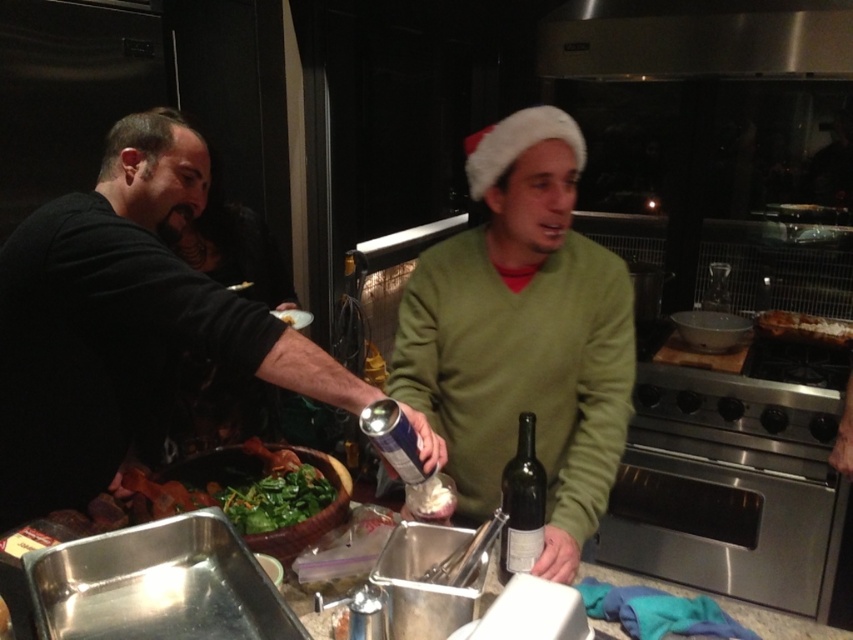
Consider the image. Is black matte shirt at left smaller than stainless steel exhaust hood at upper center?

No, black matte shirt at left is not smaller than stainless steel exhaust hood at upper center.

From the picture: Does black matte shirt at left have a lesser height compared to stainless steel exhaust hood at upper center?

No.

Is point (344, 380) closer to camera compared to point (787, 19)?

That is True.

You are a GUI agent. You are given a task and a screenshot of the screen. Output one action in this format:
    pyautogui.click(x=<x>, y=<y>)
    Task: Click on the black matte shirt at left
    Image resolution: width=853 pixels, height=640 pixels.
    Given the screenshot: What is the action you would take?
    pyautogui.click(x=123, y=323)

Is green matte sweater at center thinner than green leafy vegetables at center?

No.

Does point (506, 147) come farther from viewer compared to point (244, 500)?

Yes, point (506, 147) is behind point (244, 500).

This screenshot has width=853, height=640. What are the coordinates of `green matte sweater at center` in the screenshot? It's located at (521, 333).

Based on the photo, between black matte shirt at left and stainless steel oven at lower right, which one has more height?

black matte shirt at left is taller.

Describe the element at coordinates (123, 323) in the screenshot. I see `black matte shirt at left` at that location.

What do you see at coordinates (123, 323) in the screenshot?
I see `black matte shirt at left` at bounding box center [123, 323].

Identify the location of black matte shirt at left. (123, 323).